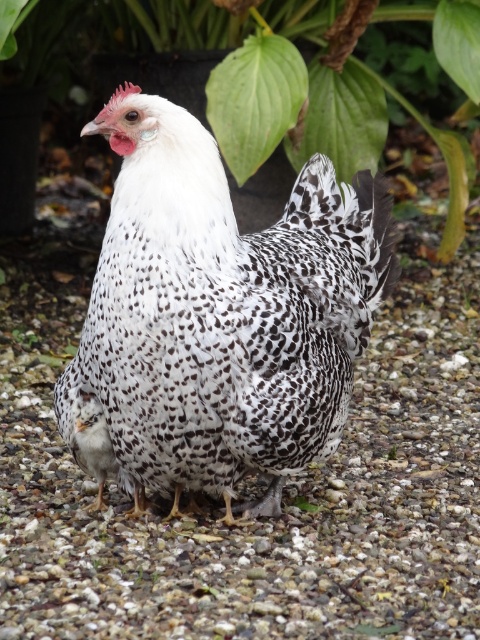
You are a photographer trying to capture the speckled feathered chicken at center and the green leafy plant at upper center in the same frame. Which object will appear larger in your photo?

The speckled feathered chicken at center will appear larger in the photo because it is closer to the viewer than the green leafy plant at upper center.

You are a gardener looking at the image. You need to place a small statue between the white gravel at center and the green leafy plant at upper center. Where should you place it to ensure it is between them?

The white gravel at center is on the right side of the green leafy plant at upper center, so place the statue to the right of the green leafy plant at upper center but left of the white gravel at center to position it between them.

Consider the image. You are a photographer trying to capture the speckled feathered chicken at center in the image. The white gravel at center is in the foreground. If you want to focus on the chicken, should you adjust your camera to focus on a closer or farther subject?

The white gravel at center is wider than the speckled feathered chicken at center. To focus on the chicken, adjust the camera to focus on a farther subject since the chicken is positioned behind the gravel.